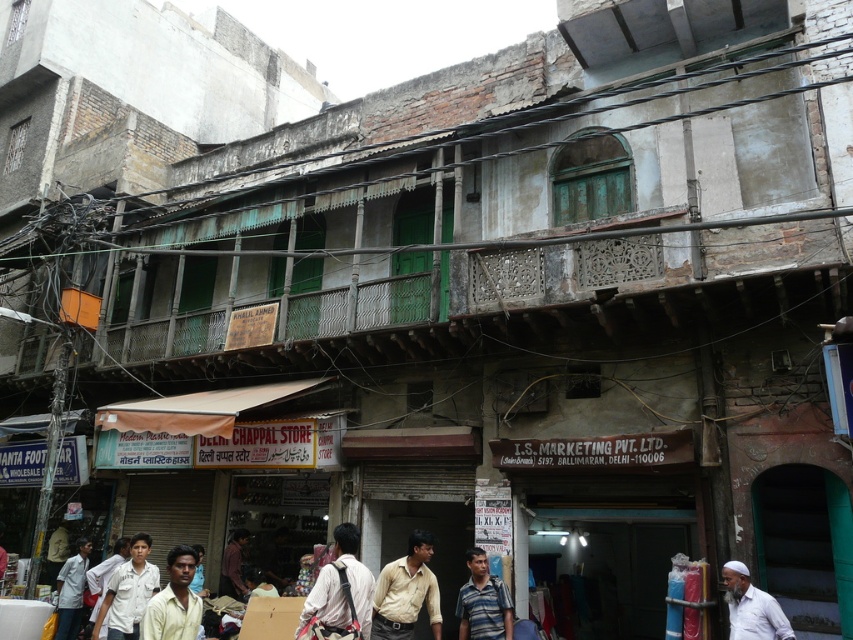
Question: Does light brown fabric shirt at center have a greater width compared to white matte shirt at lower left?

Choices:
 (A) no
 (B) yes

Answer: (A)

Question: Which is nearer to the white cotton beard at lower right?

Choices:
 (A) light blue shirt at lower left
 (B) striped cotton shirt at lower center
 (C) dark brown shirt at center

Answer: (B)

Question: Can you confirm if light brown fabric shirt at center is positioned above white matte shirt at lower left?

Choices:
 (A) no
 (B) yes

Answer: (B)

Question: Which object is positioned farthest from the white matte shirt at lower left?

Choices:
 (A) dark brown shirt at center
 (B) light brown shirt at lower left
 (C) striped cotton shirt at lower center
 (D) light blue shirt at lower left

Answer: (C)

Question: Which object is the closest to the white cotton beard at lower right?

Choices:
 (A) light blue shirt at lower left
 (B) striped cotton shirt at lower center
 (C) light brown shirt at lower left

Answer: (B)

Question: Can you confirm if light brown shirt at center is thinner than white cotton beard at lower right?

Choices:
 (A) no
 (B) yes

Answer: (A)